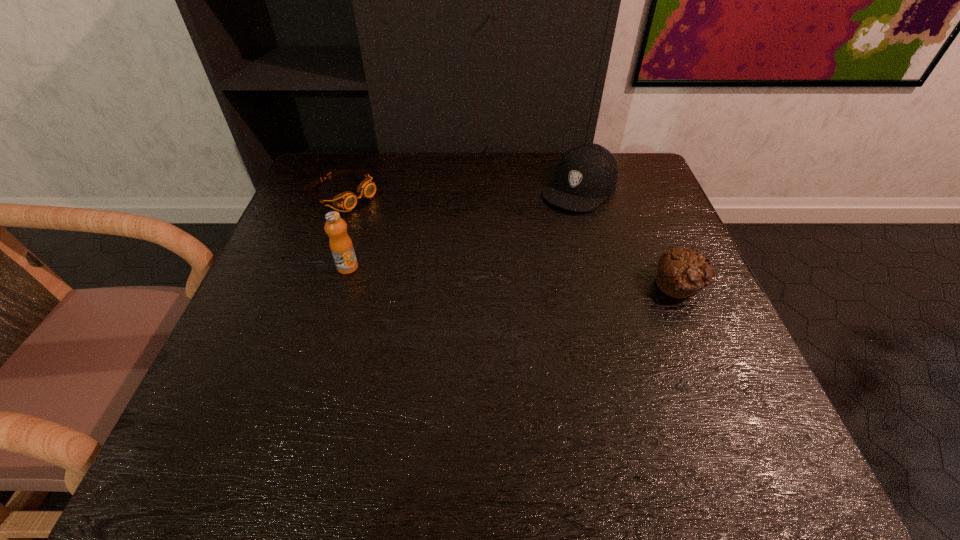
Image resolution: width=960 pixels, height=540 pixels. I want to click on vacant space on the desktop that is between the orange juice and the third tallest object and is positioned on the front-facing side of the cap, so click(489, 275).

Identify the location of vacant space on the desktop that is between the tallest object and the muffin and is positioned with the lenses facing forward on the goggles. This screenshot has width=960, height=540. (487, 275).